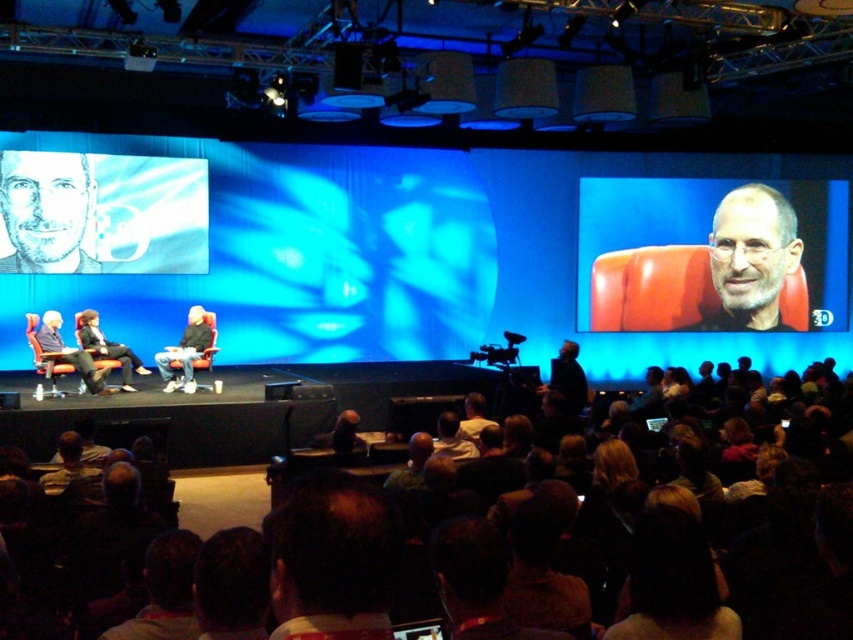
Question: Which of the following is the farthest from the observer?

Choices:
 (A) (637, 246)
 (B) (575, 387)

Answer: (A)

Question: Which point is farther to the camera?

Choices:
 (A) matte black suit at center
 (B) gray matte portrait at upper left
 (C) dark gray suit at center

Answer: (B)

Question: Which of the following is the farthest from the observer?

Choices:
 (A) dark gray suit at center
 (B) leather-like orange chair at center
 (C) matte black suit at center

Answer: (B)

Question: Does dark brown hair at lower center have a greater width compared to gray matte portrait at upper left?

Choices:
 (A) yes
 (B) no

Answer: (B)

Question: Does matte black screen at left appear over matte black chair at right?

Choices:
 (A) yes
 (B) no

Answer: (B)

Question: Observing the image, what is the correct spatial positioning of matte black screen at left in reference to gray matte portrait at upper left?

Choices:
 (A) above
 (B) below

Answer: (B)